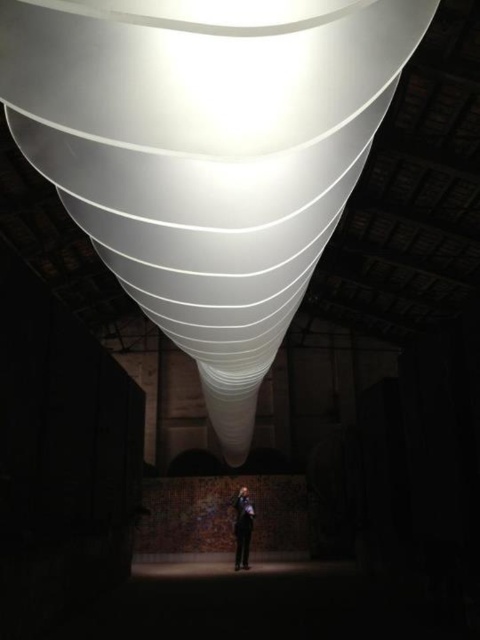
Does white glossy cone at center appear over black suit at center?

Yes.

Is point (342, 120) positioned after point (249, 529)?

No.

You are a GUI agent. You are given a task and a screenshot of the screen. Output one action in this format:
    pyautogui.click(x=<x>, y=<y>)
    Task: Click on the white glossy cone at center
    This screenshot has width=480, height=640.
    Given the screenshot: What is the action you would take?
    pyautogui.click(x=206, y=154)